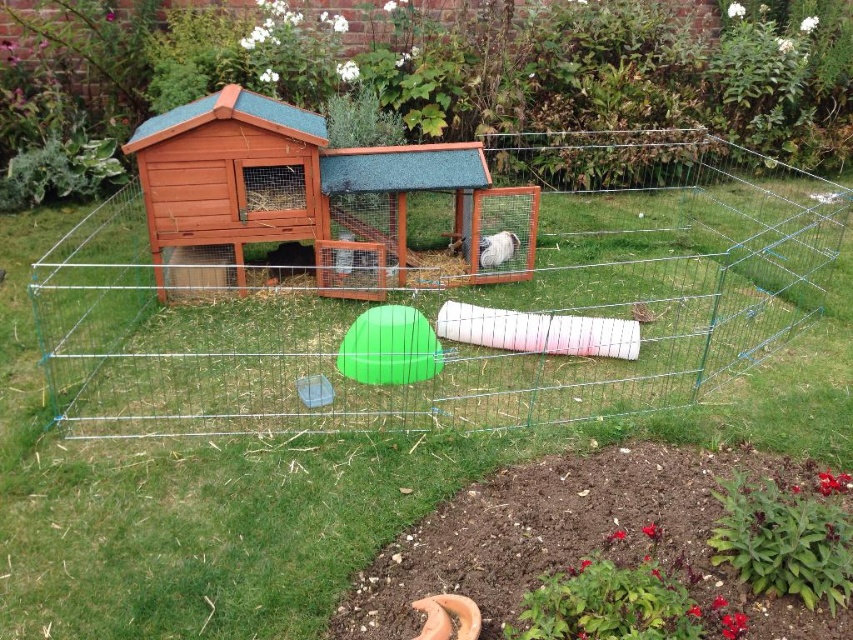
Question: Which of these objects is positioned closest to the wooden hut at center?

Choices:
 (A) brown wooden rabbit hutch at center
 (B) green wire fence at center

Answer: (A)

Question: Estimate the real-world distances between objects in this image. Which object is closer to the wooden hut at center?

Choices:
 (A) white fluffy rabbit at center
 (B) brown wooden rabbit hutch at center
 (C) green wire fence at center

Answer: (B)

Question: Which of the following is the closest to the observer?

Choices:
 (A) (225, 250)
 (B) (543, 333)
 (C) (285, 120)

Answer: (B)

Question: Can you confirm if wooden hut at center is wider than white fluffy rabbit at center?

Choices:
 (A) yes
 (B) no

Answer: (A)

Question: Observing the image, what is the correct spatial positioning of green wire fence at center in reference to brown wooden rabbit hutch at center?

Choices:
 (A) left
 (B) right

Answer: (B)

Question: Does green wire fence at center have a larger size compared to wooden hut at center?

Choices:
 (A) no
 (B) yes

Answer: (B)